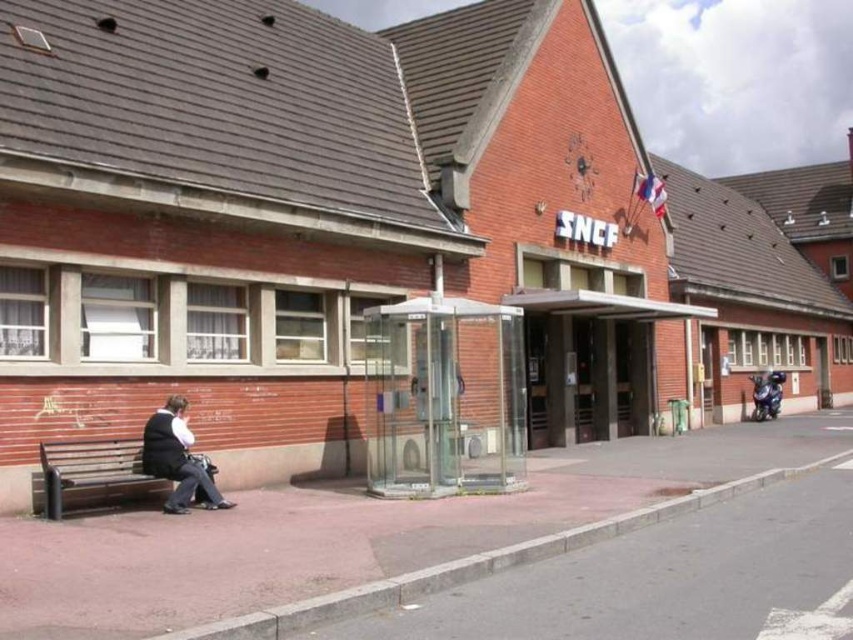
You are standing at the entrance of the SNCF building and want to find the transparent glass bus stop at center. According to the coordinates provided, in which direction should you walk to reach it?

The transparent glass bus stop at center is located at coordinates point [444,397]. Since the entrance is at the lower part of the image, you should walk upwards to reach the transparent glass bus stop at center.

Consider the image. You are standing at the entrance of the SNCF railway station and see the brown concrete pavement at lower left and the wooden bench at lower left. Which object is positioned to the right of the other?

The brown concrete pavement at lower left is to the right of the wooden bench at lower left according to the description.